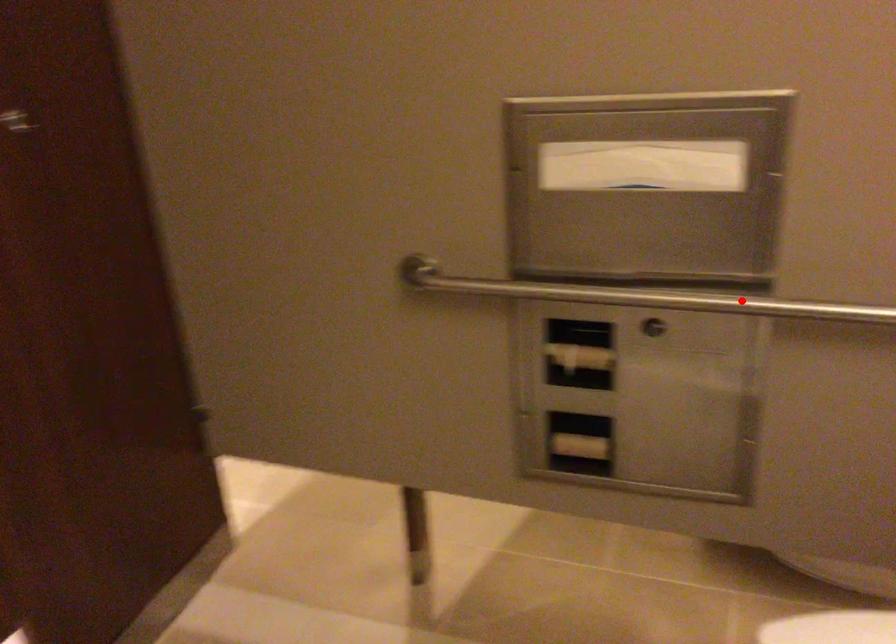
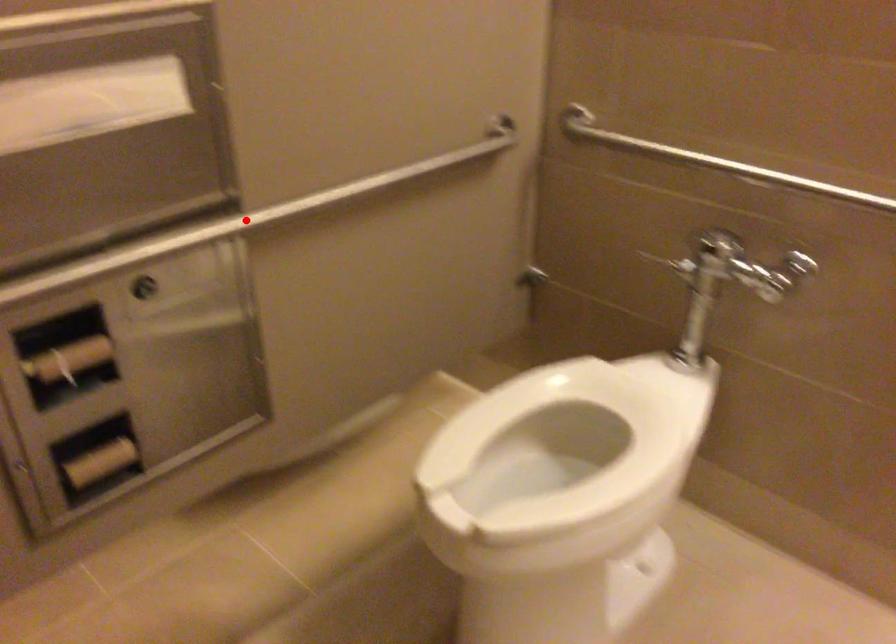
I am providing you with two images of the same scene from different viewpoints. A red point is marked on the first image and another point is marked on the second image. Is the red point in image1 aligned with the point shown in image2?

Yes